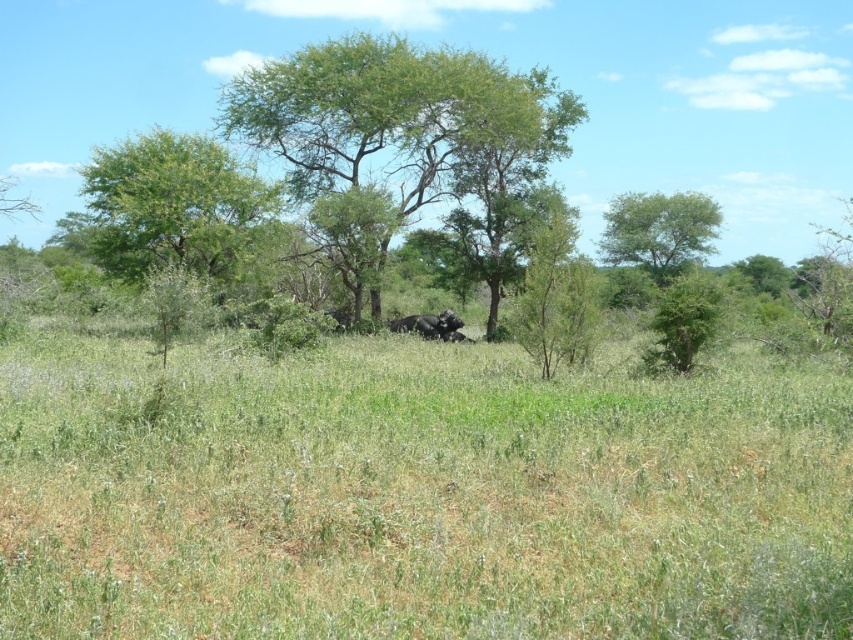
Question: Which object appears farthest from the camera in this image?

Choices:
 (A) dark gray elephant at center
 (B) green leafy tree at upper right
 (C) green grassy at center
 (D) green leafy tree at upper left

Answer: (B)

Question: Which point is farther to the camera?

Choices:
 (A) pyautogui.click(x=711, y=241)
 (B) pyautogui.click(x=831, y=536)

Answer: (A)

Question: Which object is closer to the camera taking this photo?

Choices:
 (A) green leafy tree at upper right
 (B) green grassy at center
 (C) dark gray elephant at center

Answer: (B)

Question: Does green grassy at center have a smaller size compared to green leafy tree at upper left?

Choices:
 (A) yes
 (B) no

Answer: (A)

Question: Does green leafy tree at upper left have a smaller size compared to green leafy tree at upper right?

Choices:
 (A) yes
 (B) no

Answer: (B)

Question: Is green leafy tree at upper left smaller than green leafy tree at upper right?

Choices:
 (A) no
 (B) yes

Answer: (A)